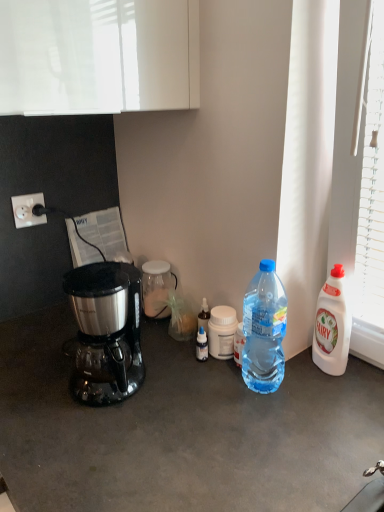
Question: Is the position of stainless steel coffee maker at left less distant than that of white plastic bottle at right, the third bottle viewed from the left?

Choices:
 (A) yes
 (B) no

Answer: (A)

Question: From the image's perspective, would you say stainless steel coffee maker at left is shown under white plastic bottle at right, the first bottle in the right-to-left sequence?

Choices:
 (A) no
 (B) yes

Answer: (B)

Question: From a real-world perspective, is stainless steel coffee maker at left positioned under white plastic bottle at right, the third bottle viewed from the left, based on gravity?

Choices:
 (A) no
 (B) yes

Answer: (B)

Question: Is stainless steel coffee maker at left wider than white plastic bottle at right, positioned as the first bottle in front-to-back order?

Choices:
 (A) no
 (B) yes

Answer: (B)

Question: Is stainless steel coffee maker at left directly adjacent to white plastic bottle at right, the third bottle viewed from the left?

Choices:
 (A) no
 (B) yes

Answer: (A)

Question: Is white plastic bottle at right, the third bottle viewed from the left, wider or thinner than stainless steel coffee maker at left?

Choices:
 (A) wide
 (B) thin

Answer: (B)

Question: From their relative heights in the image, would you say white plastic bottle at right, positioned as the first bottle in front-to-back order, is taller or shorter than stainless steel coffee maker at left?

Choices:
 (A) tall
 (B) short

Answer: (A)

Question: From the image's perspective, is white plastic bottle at right, the first bottle in the right-to-left sequence, positioned above or below stainless steel coffee maker at left?

Choices:
 (A) above
 (B) below

Answer: (A)

Question: From a real-world perspective, is white plastic bottle at right, positioned as the first bottle in front-to-back order, positioned above or below stainless steel coffee maker at left?

Choices:
 (A) above
 (B) below

Answer: (A)

Question: Would you say stainless steel coffee maker at left is to the left or to the right of transparent glass jar at center, which appears as the first bottle when viewed from the back, in the picture?

Choices:
 (A) right
 (B) left

Answer: (B)

Question: Based on their sizes in the image, would you say stainless steel coffee maker at left is bigger or smaller than transparent glass jar at center, the third bottle in the front-to-back sequence?

Choices:
 (A) big
 (B) small

Answer: (A)

Question: In the image, is stainless steel coffee maker at left positioned in front of or behind transparent glass jar at center, which appears as the first bottle when viewed from the back?

Choices:
 (A) front
 (B) behind

Answer: (A)

Question: Would you say stainless steel coffee maker at left is inside or outside transparent glass jar at center, which appears as the 1th bottle when viewed from the left?

Choices:
 (A) outside
 (B) inside

Answer: (A)

Question: In terms of width, does white plastic power outlet at left look wider or thinner when compared to stainless steel coffee maker at left?

Choices:
 (A) wide
 (B) thin

Answer: (B)

Question: From a real-world perspective, is white plastic power outlet at left positioned above or below stainless steel coffee maker at left?

Choices:
 (A) above
 (B) below

Answer: (A)